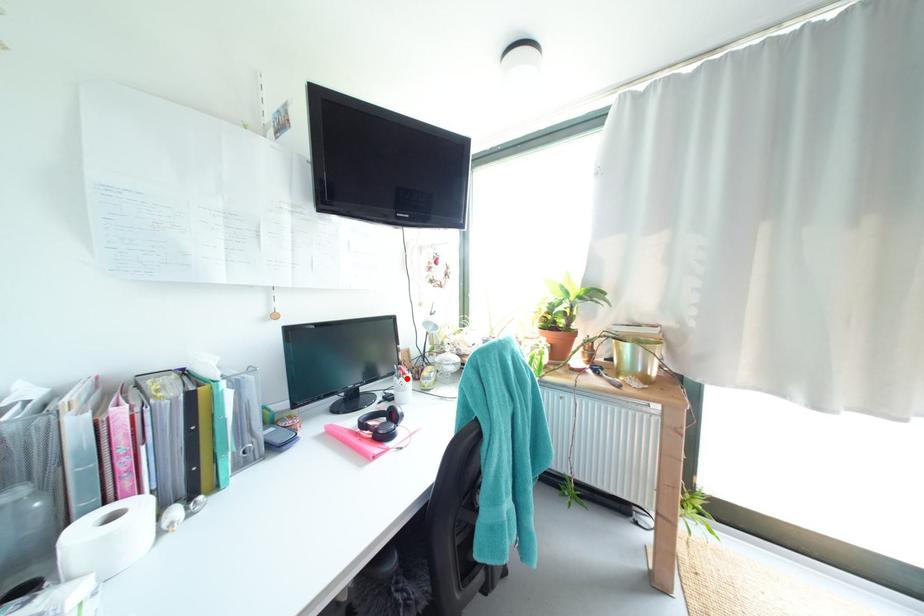
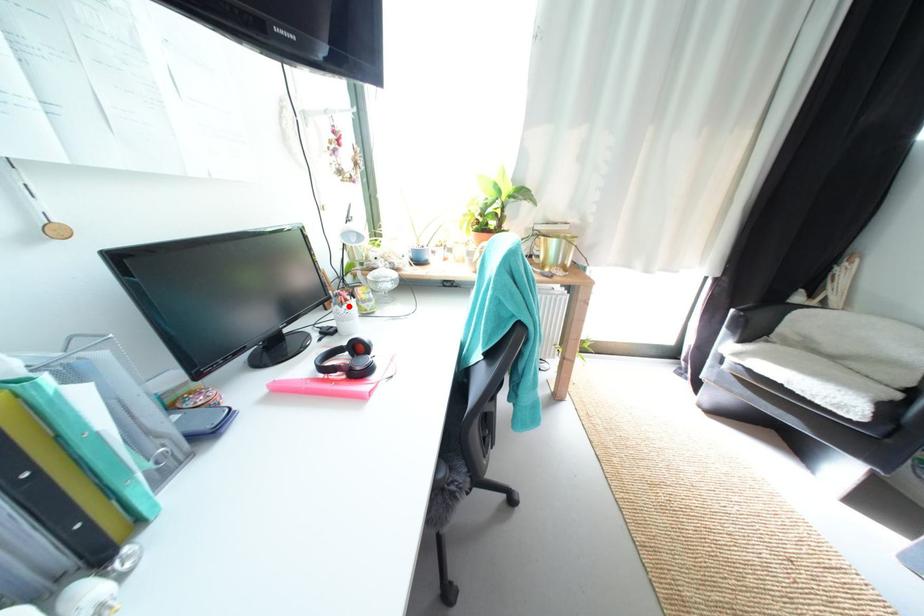
I am providing you with two images of the same scene from different viewpoints. A red point is marked on the first image and another point is marked on the second image. Does the point marked in image1 correspond to the same location as the one in image2?

Yes